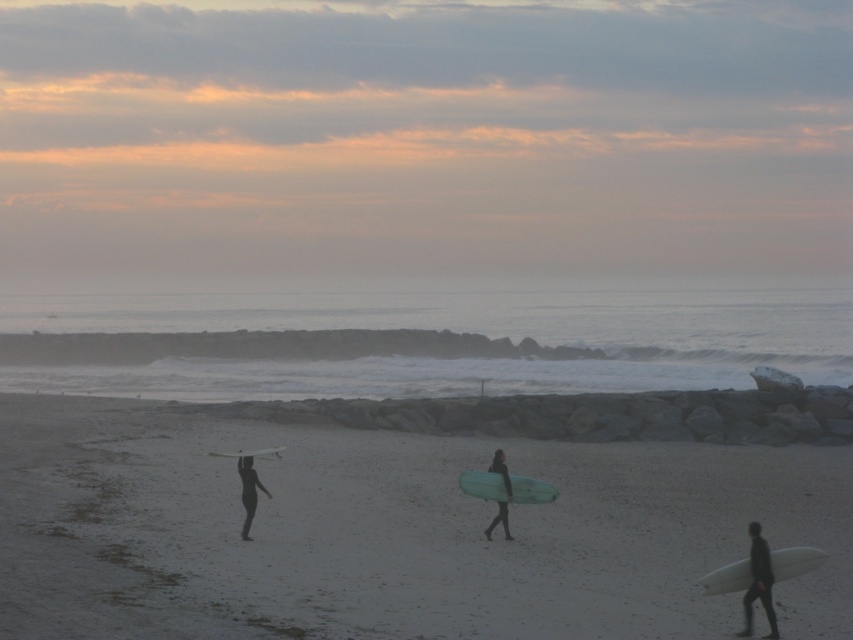
You are a photographer planning to capture the surfers and their surfboards against the sunset. You want to ensure the translucent green surfboard at center and the white glossy surfboard at center are both clearly visible in the photo. Given their positions, which surfboard might be more challenging to photograph clearly, and why?

The translucent green surfboard at center might be more challenging to photograph clearly because it is positioned below the white glossy surfboard at center, potentially causing it to be obscured or less visible against the bright sunset backdrop.

You are a photographer trying to capture the three surfers walking along the beach. You want to ensure that both the dark matte wetsuit at lower right and the black wetsuit at center are visible in your shot. Based on their positions, which wetsuit is positioned more to the right side of the image?

The dark matte wetsuit at lower right is positioned more to the right side of the image compared to the black wetsuit at center.

You are a photographer planning to capture a wide shot of the beach scene. The white matte surfboard at lower right and the black wetsuit at lower left are in your frame. Considering their sizes, which object would appear larger in your photo?

The white matte surfboard at lower right would appear larger in the photo because its width is greater than that of the black wetsuit at lower left.